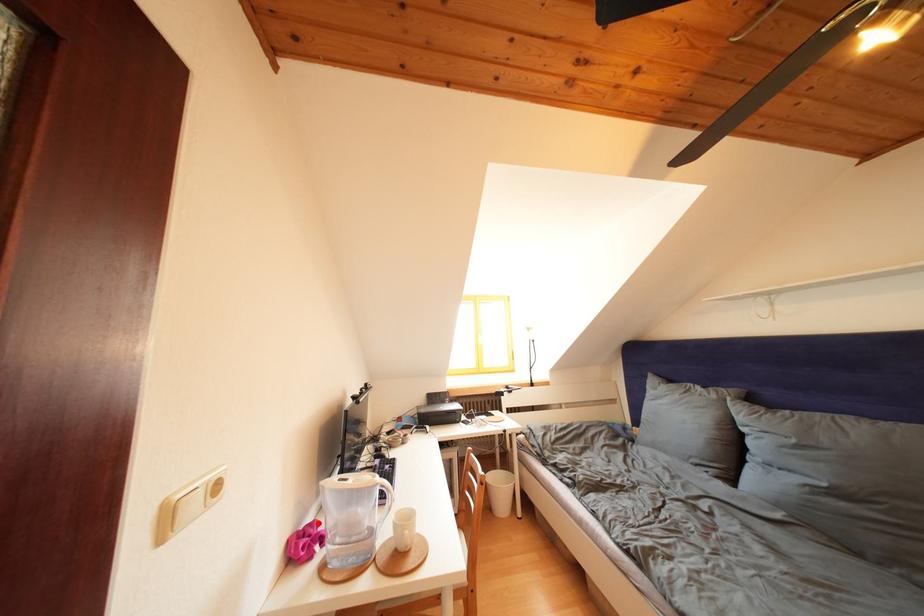
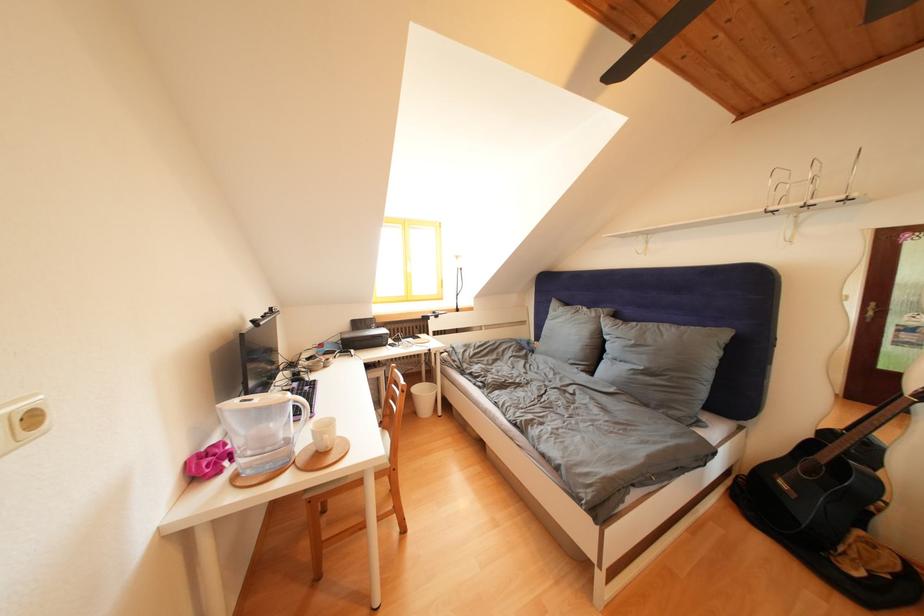
Where in the second image is the point corresponding to the highlighted location from the first image?

(223, 446)